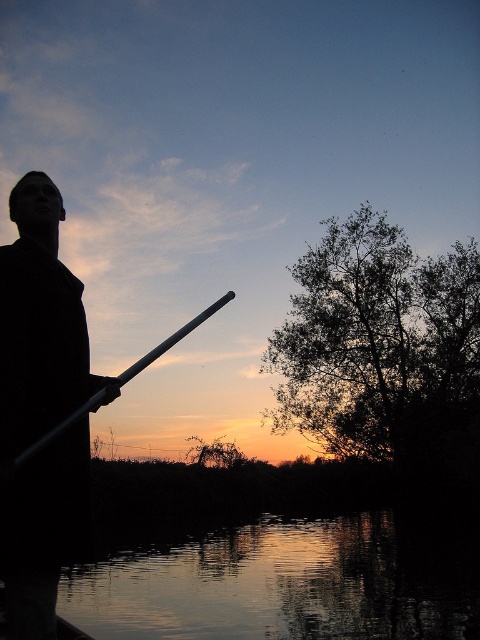
Question: Among these points, which one is nearest to the camera?

Choices:
 (A) (147, 595)
 (B) (158, 346)

Answer: (B)

Question: Is black matte coat at left below metallic silver paddle at center?

Choices:
 (A) no
 (B) yes

Answer: (B)

Question: Where is black matte coat at left located in relation to metallic silver paddle at center in the image?

Choices:
 (A) above
 (B) below

Answer: (B)

Question: Based on their relative distances, which object is nearer to the black matte coat at left?

Choices:
 (A) silvery reflective water at lower center
 (B) metallic silver paddle at center

Answer: (B)

Question: Can you confirm if silvery reflective water at lower center is thinner than black matte coat at left?

Choices:
 (A) no
 (B) yes

Answer: (A)

Question: Which point is closer to the camera taking this photo?

Choices:
 (A) (172, 344)
 (B) (8, 404)
 (C) (299, 536)

Answer: (B)